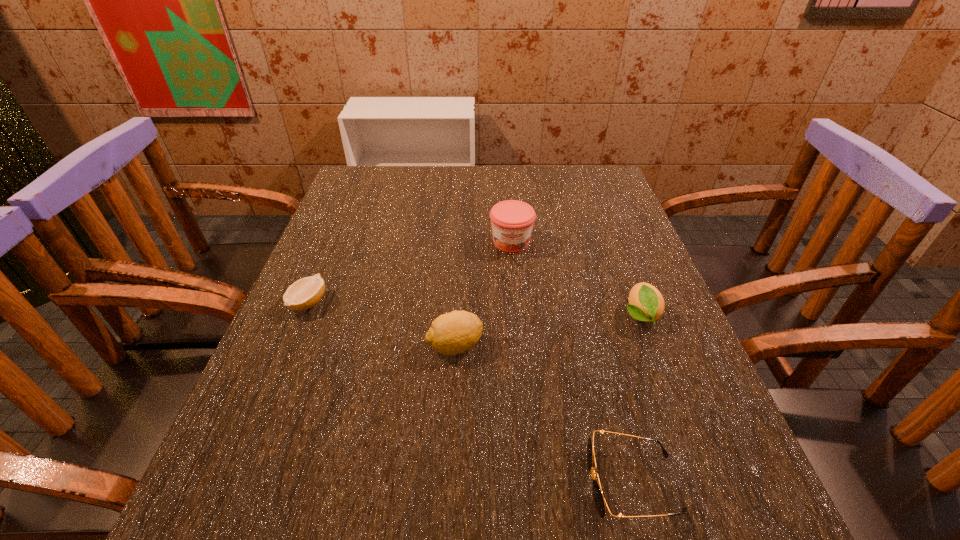
In the image, there is a desktop. At what (x,y) coordinates should I click in order to perform the action: click on vacant space at the far edge. Please return your answer as a coordinate pair (x, y). This screenshot has height=540, width=960. Looking at the image, I should click on (515, 182).

At what (x,y) coordinates should I click in order to perform the action: click on vacant area at the near edge. Please return your answer as a coordinate pair (x, y). This screenshot has width=960, height=540. Looking at the image, I should click on (649, 538).

At what (x,y) coordinates should I click in order to perform the action: click on vacant space at the left edge. Please return your answer as a coordinate pair (x, y). The image size is (960, 540). Looking at the image, I should click on (254, 468).

You are a GUI agent. You are given a task and a screenshot of the screen. Output one action in this format:
    pyautogui.click(x=<x>, y=<y>)
    Task: Click on the vacant point at the right edge
    The image size is (960, 540).
    Given the screenshot: What is the action you would take?
    pyautogui.click(x=627, y=219)

At what (x,y) coordinates should I click in order to perform the action: click on free space at the far right corner of the desktop. Please return your answer as a coordinate pair (x, y). Looking at the image, I should click on (572, 206).

I want to click on free space at the near right corner, so click(x=726, y=523).

This screenshot has height=540, width=960. Find the location of `blank region between the rightmost lemon and the jam`. blank region between the rightmost lemon and the jam is located at coordinates (576, 279).

Image resolution: width=960 pixels, height=540 pixels. I want to click on unoccupied area between the sunglasses and the rightmost object, so click(636, 399).

Where is `unoccupied area between the shortest lemon and the third object from right to left`? The image size is (960, 540). unoccupied area between the shortest lemon and the third object from right to left is located at coordinates (410, 272).

Find the location of `blank region between the third object from left to right and the leftmost object`. blank region between the third object from left to right and the leftmost object is located at coordinates (410, 272).